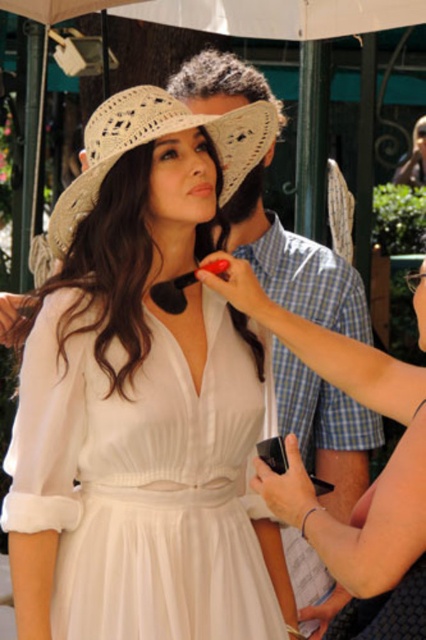
Question: Which object is closer to the camera taking this photo?

Choices:
 (A) white chiffon dress at center
 (B) white matte dress at center
 (C) woven straw hat at upper center

Answer: (B)

Question: Which point appears farthest from the camera in this image?

Choices:
 (A) pos(232,177)
 (B) pos(420,493)

Answer: (A)

Question: Can you confirm if white chiffon dress at center is wider than white matte dress at center?

Choices:
 (A) no
 (B) yes

Answer: (B)

Question: Does white chiffon dress at center appear on the right side of woven straw hat at upper center?

Choices:
 (A) yes
 (B) no

Answer: (B)

Question: Which object is farther from the camera taking this photo?

Choices:
 (A) white matte dress at center
 (B) white chiffon dress at center
 (C) woven straw hat at upper center

Answer: (C)

Question: Does white matte dress at center have a greater width compared to woven straw hat at upper center?

Choices:
 (A) no
 (B) yes

Answer: (A)